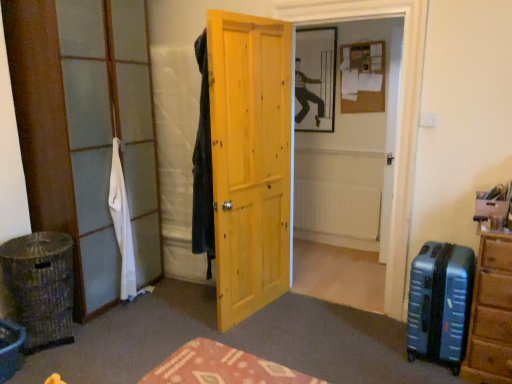
Measure the distance between point (72, 63) and camera.

They are 8.57 feet apart.

Locate an element on the screen. The height and width of the screenshot is (384, 512). clear glass door at left is located at coordinates (110, 137).

Image resolution: width=512 pixels, height=384 pixels. I want to click on yellow wood door at center, so click(250, 160).

Would you consider blue hardshell suitcase at right to be distant from white matte radiator at center?

blue hardshell suitcase at right is far away from white matte radiator at center.

Which point is more forward, (430, 253) or (365, 212)?

Positioned in front is point (430, 253).

Does blue hardshell suitcase at right have a smaller size compared to white matte radiator at center?

Actually, blue hardshell suitcase at right might be larger than white matte radiator at center.

Considering the relative positions of clear glass door at left and white fabric at left in the image provided, is clear glass door at left to the left or to the right of white fabric at left?

clear glass door at left is positioned on white fabric at left's left side.

Considering the sizes of objects clear glass door at left and white fabric at left in the image provided, who is bigger, clear glass door at left or white fabric at left?

Bigger between the two is clear glass door at left.

Is point (142, 121) positioned in front of point (118, 178)?

No, (142, 121) is further to viewer.

Does point (4, 243) appear closer or farther from the camera than point (270, 105)?

Point (4, 243).

Is brown woven laundry basket at lower left aimed at yellow wood door at center?

No, brown woven laundry basket at lower left is not oriented towards yellow wood door at center.

Considering the relative sizes of brown woven laundry basket at lower left and yellow wood door at center in the image provided, is brown woven laundry basket at lower left thinner than yellow wood door at center?

Incorrect, the width of brown woven laundry basket at lower left is not less than that of yellow wood door at center.

From the image's perspective, who appears lower, yellow wood door at center or brown woven laundry basket at lower left?

brown woven laundry basket at lower left, from the image's perspective.

Can you confirm if yellow wood door at center is smaller than brown woven laundry basket at lower left?

Incorrect, yellow wood door at center is not smaller in size than brown woven laundry basket at lower left.

Is yellow wood door at center further to camera compared to brown woven laundry basket at lower left?

No, yellow wood door at center is closer to the viewer.

Based on the photo, which is closer, (238,262) or (54,301)?

Point (238,262) appears to be farther away from the viewer than point (54,301).

From a real-world perspective, who is located lower, white fabric at left or yellow wood door at center?

white fabric at left.

Is the depth of white fabric at left greater than that of yellow wood door at center?

Yes, white fabric at left is further from the viewer.

Which of these two, white fabric at left or yellow wood door at center, is smaller?

white fabric at left is smaller.

From the picture: Considering the sizes of white fabric at left and yellow wood door at center in the image, is white fabric at left taller or shorter than yellow wood door at center?

Clearly, white fabric at left is shorter compared to yellow wood door at center.

Can you confirm if patterned fabric tablecloth at center is positioned to the left of clear glass door at left?

No.

Could you tell me if patterned fabric tablecloth at center is facing clear glass door at left?

No.

How different are the orientations of patterned fabric tablecloth at center and clear glass door at left in degrees?

The angular difference between patterned fabric tablecloth at center and clear glass door at left is 87 degrees.

Which of these two, patterned fabric tablecloth at center or clear glass door at left, is bigger?

clear glass door at left is bigger.

Is yellow wood door at center beside patterned fabric tablecloth at center?

No, yellow wood door at center is not making contact with patterned fabric tablecloth at center.

Is patterned fabric tablecloth at center at the back of yellow wood door at center?

No, yellow wood door at center's orientation is not away from patterned fabric tablecloth at center.

The width and height of the screenshot is (512, 384). What are the coordinates of `door located above the patterned fabric tablecloth at center (from the image's perspective)` in the screenshot? It's located at click(250, 160).

Where is `luggage located in front of the white matte radiator at center`? This screenshot has width=512, height=384. luggage located in front of the white matte radiator at center is located at coordinates (440, 303).

Locate an element on the screen. This screenshot has height=384, width=512. clothing behind the clear glass door at left is located at coordinates (122, 224).

Based on their spatial positions, is brown woven laundry basket at lower left or white fabric at left further from white matte radiator at center?

brown woven laundry basket at lower left is positioned further to the anchor white matte radiator at center.

Considering their positions, is brown woven laundry basket at lower left positioned closer to clear glass door at left than white matte radiator at center?

Among the two, brown woven laundry basket at lower left is located nearer to clear glass door at left.

Which object lies nearer to the anchor point white matte radiator at center, clear glass door at left or white fabric at left?

clear glass door at left is closer to white matte radiator at center.

From the image, which object appears to be nearer to white fabric at left, brown woven laundry basket at lower left or white matte radiator at center?

The object closer to white fabric at left is brown woven laundry basket at lower left.

When comparing their distances from patterned fabric tablecloth at center, does white fabric at left or clear glass door at left seem closer?

Based on the image, white fabric at left appears to be nearer to patterned fabric tablecloth at center.

From the image, which object appears to be farther from brown woven laundry basket at lower left, patterned fabric tablecloth at center or clear glass door at left?

patterned fabric tablecloth at center.

Considering their positions, is clear glass door at left positioned closer to yellow wood door at center than patterned fabric tablecloth at center?

Based on the image, clear glass door at left appears to be nearer to yellow wood door at center.

Estimate the real-world distances between objects in this image. Which object is further from clear glass door at left, patterned fabric tablecloth at center or brown woven laundry basket at lower left?

patterned fabric tablecloth at center.

Where is `door between brown woven laundry basket at lower left and white matte radiator at center from left to right`? door between brown woven laundry basket at lower left and white matte radiator at center from left to right is located at coordinates (250, 160).

Identify the location of door between blue hardshell suitcase at right and white matte radiator at center along the z-axis. (250, 160).

I want to click on clothing located between brown woven laundry basket at lower left and white matte radiator at center in the left-right direction, so click(122, 224).

Locate an element on the screen. door between white fabric at left and blue hardshell suitcase at right in the horizontal direction is located at coordinates coord(250,160).